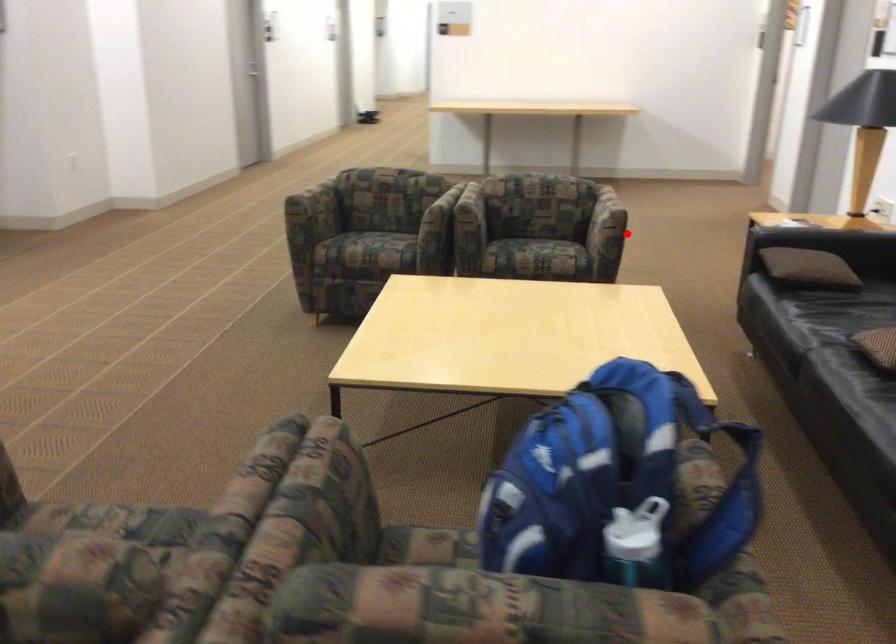
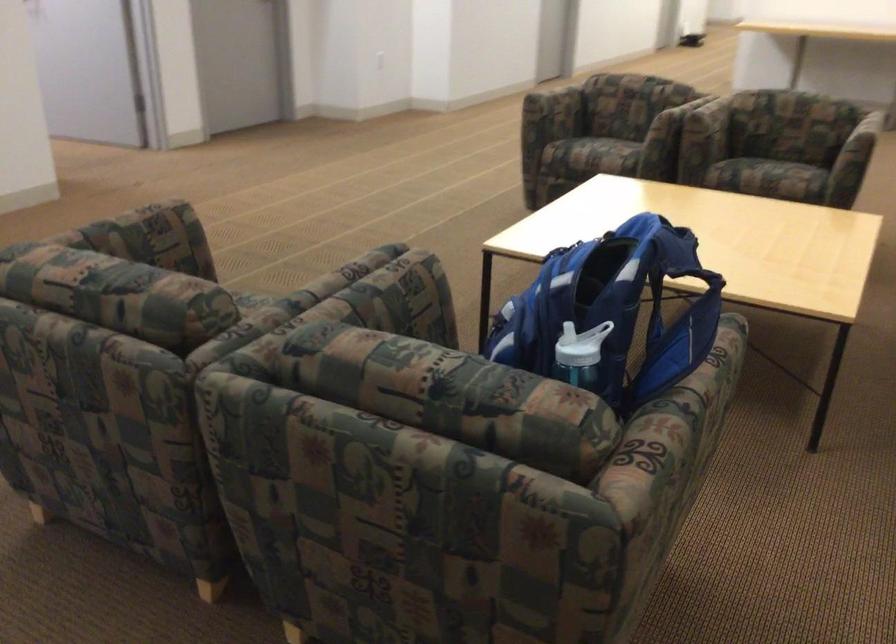
Where in the second image is the point corresponding to the highlighted location from the first image?

(858, 152)